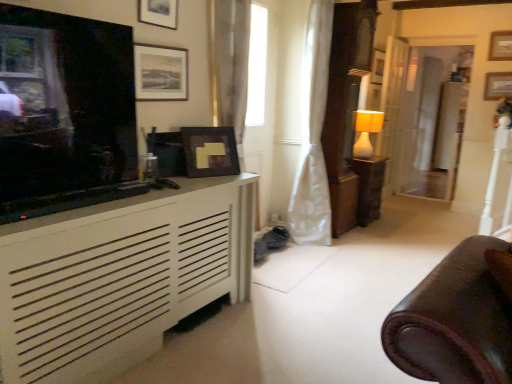
The height and width of the screenshot is (384, 512). What do you see at coordinates (160, 73) in the screenshot?
I see `matte black picture frame at upper center, the 6th picture frame when ordered from right to left` at bounding box center [160, 73].

Image resolution: width=512 pixels, height=384 pixels. I want to click on matte black picture frame at upper center, acting as the 2th picture frame starting from the left, so click(x=159, y=13).

At what (x,y) coordinates should I click in order to perform the action: click on matte black television at left. Please return your answer as a coordinate pair (x, y). This screenshot has height=384, width=512. Looking at the image, I should click on (66, 113).

The width and height of the screenshot is (512, 384). What do you see at coordinates (498, 86) in the screenshot? I see `wooden picture frame at upper right, placed as the second picture frame when sorted from back to front` at bounding box center [498, 86].

Measure the distance between wooden picture frame at upper right, placed as the second picture frame when sorted from back to front, and camera.

The depth of wooden picture frame at upper right, placed as the second picture frame when sorted from back to front, is 4.81 meters.

Where is `matte black picture frame at upper center, arranged as the fifth picture frame when viewed from the back`? matte black picture frame at upper center, arranged as the fifth picture frame when viewed from the back is located at coordinates (160, 73).

Is matte white lamp at center-right in front of white wood door at center right?

Yes, it is in front of white wood door at center right.

Find the location of a particular element. door behind the matte white lamp at center-right is located at coordinates (392, 106).

Can you confirm if matte white lamp at center-right is thinner than white wood door at center right?

No, matte white lamp at center-right is not thinner than white wood door at center right.

Is matte white lamp at center-right oriented away from white wood door at center right?

No, matte white lamp at center-right is not facing the opposite direction of white wood door at center right.

Which is more to the right, matte brown wooden table at center-right or wooden picture frame at upper right, the sixth picture frame viewed from the left?

From the viewer's perspective, wooden picture frame at upper right, the sixth picture frame viewed from the left, appears more on the right side.

Is wooden picture frame at upper right, the fourth picture frame from the front, at the back of matte brown wooden table at center-right?

No.

Is matte brown wooden table at center-right positioned beyond the bounds of wooden picture frame at upper right, which is the third picture frame in back-to-front order?

Yes, matte brown wooden table at center-right is located beyond the bounds of wooden picture frame at upper right, which is the third picture frame in back-to-front order.

Can you confirm if matte brown wooden table at center-right is bigger than wooden picture frame at upper right, the sixth picture frame viewed from the left?

Yes, matte brown wooden table at center-right is bigger than wooden picture frame at upper right, the sixth picture frame viewed from the left.

Considering the relative positions of matte black picture frame at upper center, acting as the 2th picture frame starting from the left, and white wood door at center right in the image provided, is matte black picture frame at upper center, acting as the 2th picture frame starting from the left, to the right of white wood door at center right from the viewer's perspective?

Incorrect, matte black picture frame at upper center, acting as the 2th picture frame starting from the left, is not on the right side of white wood door at center right.

Can you confirm if matte black picture frame at upper center, arranged as the first picture frame when viewed from the front, is wider than white wood door at center right?

In fact, matte black picture frame at upper center, arranged as the first picture frame when viewed from the front, might be narrower than white wood door at center right.

Is matte black picture frame at upper center, which is the sixth picture frame in back-to-front order, facing towards white wood door at center right?

No, matte black picture frame at upper center, which is the sixth picture frame in back-to-front order, is not turned towards white wood door at center right.

From a real-world perspective, which picture frame is the 4th one above the white wood door at center right? Please provide its 2D coordinates.

[(159, 13)]

In the scene shown: Is matte black picture frame at upper center, which is counted as the third picture frame, starting from the left, closer to camera compared to white satin curtain at center?

Yes, it is.

Is matte black picture frame at upper center, which ranks as the third picture frame in front-to-back order, not close to white satin curtain at center?

matte black picture frame at upper center, which ranks as the third picture frame in front-to-back order, is positioned a significant distance from white satin curtain at center.

Does matte black picture frame at upper center, placed as the 4th picture frame when sorted from back to front, appear on the left side of white satin curtain at center?

Correct, you'll find matte black picture frame at upper center, placed as the 4th picture frame when sorted from back to front, to the left of white satin curtain at center.

In the scene shown: What's the angular difference between wooden picture frame at upper right, which is the third picture frame in back-to-front order, and matte black picture frame at upper center, which is the sixth picture frame in back-to-front order,'s facing directions?

There is a 89.7-degree angle between the facing directions of wooden picture frame at upper right, which is the third picture frame in back-to-front order, and matte black picture frame at upper center, which is the sixth picture frame in back-to-front order.

Would you say wooden picture frame at upper right, the sixth picture frame viewed from the left, is outside matte black picture frame at upper center, acting as the fifth picture frame starting from the right?

wooden picture frame at upper right, the sixth picture frame viewed from the left, lies outside matte black picture frame at upper center, acting as the fifth picture frame starting from the right,'s area.

Considering the sizes of objects wooden picture frame at upper right, which is the third picture frame in back-to-front order, and matte black picture frame at upper center, arranged as the first picture frame when viewed from the front, in the image provided, who is shorter, wooden picture frame at upper right, which is the third picture frame in back-to-front order, or matte black picture frame at upper center, arranged as the first picture frame when viewed from the front,?

matte black picture frame at upper center, arranged as the first picture frame when viewed from the front.

From a real-world perspective, is wooden picture frame at upper right, which is counted as the first picture frame, starting from the right, above or below matte black picture frame at upper center, arranged as the first picture frame when viewed from the front?

Clearly, from a real-world perspective, wooden picture frame at upper right, which is counted as the first picture frame, starting from the right, is above matte black picture frame at upper center, arranged as the first picture frame when viewed from the front.

Which of these two, matte white lamp at center-right or wooden picture frame at upper right, which appears as the fifth picture frame when viewed from the left, is smaller?

Smaller between the two is wooden picture frame at upper right, which appears as the fifth picture frame when viewed from the left.

Is matte white lamp at center-right inside the boundaries of wooden picture frame at upper right, which appears as the fifth picture frame when viewed from the left, or outside?

The correct answer is: outside.

Considering the sizes of objects matte white lamp at center-right and wooden picture frame at upper right, the 2th picture frame from the right, in the image provided, who is taller, matte white lamp at center-right or wooden picture frame at upper right, the 2th picture frame from the right,?

Standing taller between the two is matte white lamp at center-right.

From a real-world perspective, which object rests below the other?

matte white lamp at center-right is physically lower.

Which is more to the left, wooden picture frame at upper center, which is counted as the fourth picture frame, starting from the left, or matte brown wooden table at center-right?

matte brown wooden table at center-right is more to the left.

What are the coordinates of `table to the left of wooden picture frame at upper center, the 6th picture frame from the front` in the screenshot? It's located at (369, 187).

What's the angular difference between wooden picture frame at upper center, the 6th picture frame from the front, and matte brown wooden table at center-right's facing directions?

The facing directions of wooden picture frame at upper center, the 6th picture frame from the front, and matte brown wooden table at center-right are 0.459 degrees apart.

Do you think wooden picture frame at upper center, marked as the third picture frame in a right-to-left arrangement, is within matte brown wooden table at center-right, or outside of it?

wooden picture frame at upper center, marked as the third picture frame in a right-to-left arrangement, is not inside matte brown wooden table at center-right, it's outside.

At what (x,y) coordinates should I click in order to perform the action: click on door above the matte white lamp at center-right (from the image's perspective). Please return your answer as a coordinate pair (x, y). The image size is (512, 384). Looking at the image, I should click on (392, 106).

The image size is (512, 384). Find the location of `table that appears below the wooden picture frame at upper right, the sixth picture frame viewed from the left (from a real-world perspective)`. table that appears below the wooden picture frame at upper right, the sixth picture frame viewed from the left (from a real-world perspective) is located at coordinates (369, 187).

From the picture: When comparing their distances from white matte cabinet at left, does matte black television at left or matte brown wooden table at center-right seem closer?

matte black television at left is closer to white matte cabinet at left.

Estimate the real-world distances between objects in this image. Which object is closer to wooden picture frame at upper center, marked as the third picture frame in a right-to-left arrangement, white matte cabinet at left or matte black picture frame at upper center, which is the sixth picture frame in back-to-front order?

matte black picture frame at upper center, which is the sixth picture frame in back-to-front order.

Looking at the image, which one is located closer to wooden picture frame at upper right, the fifth picture frame viewed from the front, matte white lamp at center-right or matte black television at left?

matte white lamp at center-right is positioned closer to the anchor wooden picture frame at upper right, the fifth picture frame viewed from the front.

From the image, which object appears to be nearer to matte black picture frame at upper center, the 6th picture frame when ordered from right to left, matte white lamp at center-right or wooden picture frame at upper center, marked as the third picture frame in a right-to-left arrangement?

Based on the image, matte white lamp at center-right appears to be nearer to matte black picture frame at upper center, the 6th picture frame when ordered from right to left.

Based on their spatial positions, is white wood door at center right or matte black picture frame at upper center, which is the first picture frame from left to right, closer to matte black television at left?

matte black picture frame at upper center, which is the first picture frame from left to right, is positioned closer to the anchor matte black television at left.

Based on the photo, from the image, which object appears to be farther from wooden picture frame at upper right, placed as the second picture frame when sorted from back to front, matte black picture frame at upper center, which is counted as the third picture frame, starting from the left, or wooden picture frame at upper right, the fourth picture frame from the front?

Among the two, matte black picture frame at upper center, which is counted as the third picture frame, starting from the left, is located further to wooden picture frame at upper right, placed as the second picture frame when sorted from back to front.

When comparing their distances from wooden picture frame at upper center, the 6th picture frame from the front, does matte white lamp at center-right or matte black picture frame at upper center, the 6th picture frame when ordered from right to left, seem closer?

Among the two, matte white lamp at center-right is located nearer to wooden picture frame at upper center, the 6th picture frame from the front.

Looking at the image, which one is located further to wooden picture frame at upper right, which is counted as the first picture frame, starting from the right, wooden picture frame at upper right, the fifth picture frame viewed from the front, or wooden picture frame at upper center, marked as the third picture frame in a right-to-left arrangement?

The object further to wooden picture frame at upper right, which is counted as the first picture frame, starting from the right, is wooden picture frame at upper center, marked as the third picture frame in a right-to-left arrangement.

At what (x,y) coordinates should I click in order to perform the action: click on cabinetry between matte black television at left and wooden picture frame at upper right, placed as the second picture frame when sorted from back to front, in the horizontal direction. Please return your answer as a coordinate pair (x, y). This screenshot has width=512, height=384. Looking at the image, I should click on (119, 277).

Locate an element on the screen. door between matte black picture frame at upper center, the 2th picture frame in the front-to-back sequence, and wooden picture frame at upper center, the 6th picture frame from the front, in the front-back direction is located at coordinates (392, 106).

Image resolution: width=512 pixels, height=384 pixels. In order to click on table located between matte black picture frame at upper center, which is the sixth picture frame in back-to-front order, and wooden picture frame at upper right, placed as the second picture frame when sorted from back to front, in the left-right direction in this screenshot , I will do `click(369, 187)`.

Image resolution: width=512 pixels, height=384 pixels. Identify the location of curtain located between white matte cabinet at left and matte white lamp at center-right in the depth direction. click(313, 134).